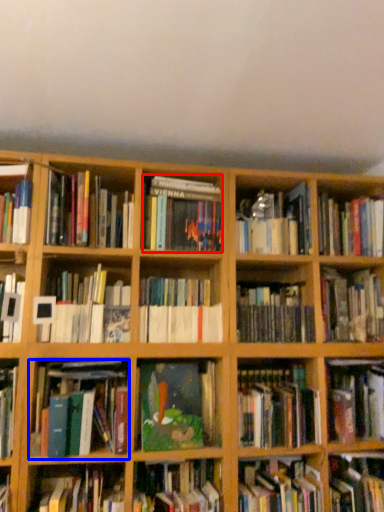
Question: Which point is further to the camera, book (highlighted by a red box) or book (highlighted by a blue box)?

Choices:
 (A) book
 (B) book

Answer: (A)